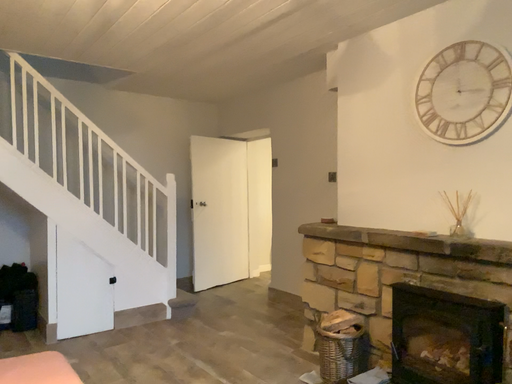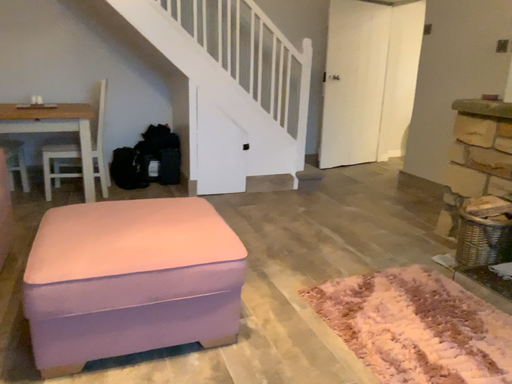
Question: Which way did the camera rotate in the video?

Choices:
 (A) rotated downward
 (B) rotated upward

Answer: (A)